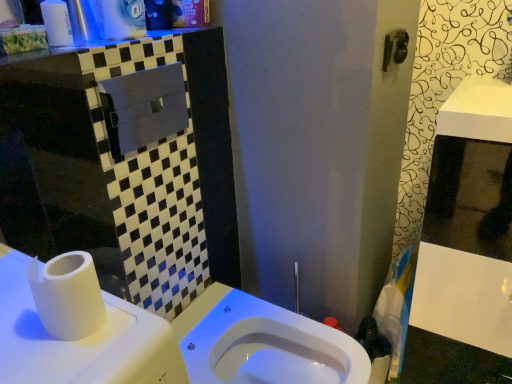
Question: From the image's perspective, relative to white plastic cup at upper left, is white glossy counter top at upper left above or below?

Choices:
 (A) below
 (B) above

Answer: (A)

Question: Is white glossy counter top at upper left to the left or to the right of white plastic cup at upper left in the image?

Choices:
 (A) left
 (B) right

Answer: (B)

Question: Estimate the real-world distances between objects in this image. Which object is farther from the white glossy medicine cabinet at right?

Choices:
 (A) white matte toilet paper at left
 (B) white glossy toilet at center
 (C) white plastic cup at upper left
 (D) white glossy counter top at upper left

Answer: (C)

Question: Estimate the real-world distances between objects in this image. Which object is farther from the white glossy counter top at upper left?

Choices:
 (A) white plastic cup at upper left
 (B) white matte toilet paper at left
 (C) white glossy toilet at center
 (D) white glossy medicine cabinet at right

Answer: (D)